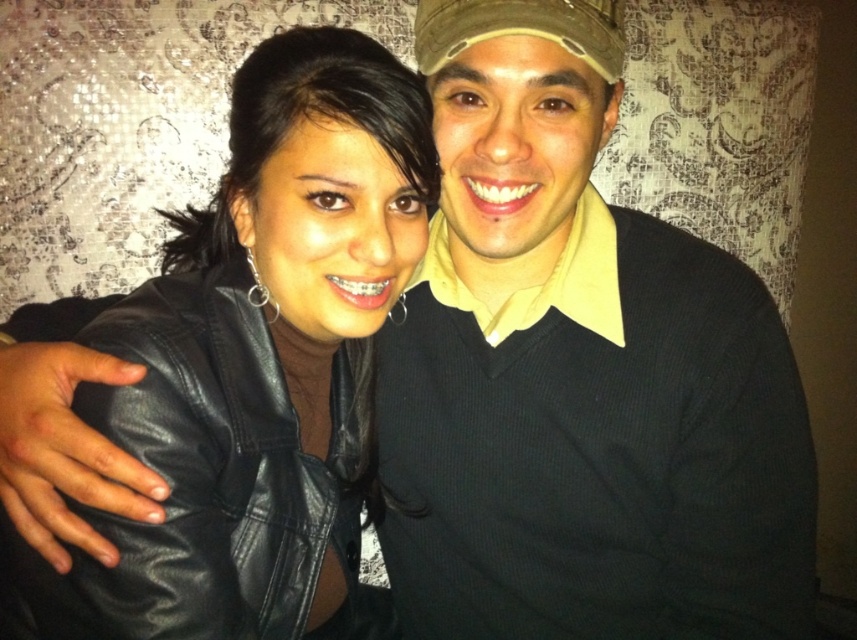
You are trying to decide which item to take with you for a quick trip. You can only choose between the black sweater at center and the black leather jacket at center. Based on their sizes, which one is more suitable for packing efficiently?

The black sweater at center is thinner than the black leather jacket at center, so it would be more suitable for packing efficiently as it takes up less space.

Based on the photo, you are standing in a room with two people dressed in black clothing. You notice a black sweater at center and a black leather jacket at center. Which item is nearer to you?

The black sweater at center is closer to the viewer than the black leather jacket at center.

You are a photographer setting up a camera 10 feet away from the two people in the image. You want to ensure that both the black sweater at center and the black leather jacket at center are in focus. Given that the camera has a depth of field that can cover objects within 6 inches of each other, will both items be in focus?

The black sweater at center is 6.80 inches away from the black leather jacket at center. Since the camera can only cover objects within 6 inches, the distance between them exceeds the depth of field range. Therefore, both items may not be in focus simultaneously.